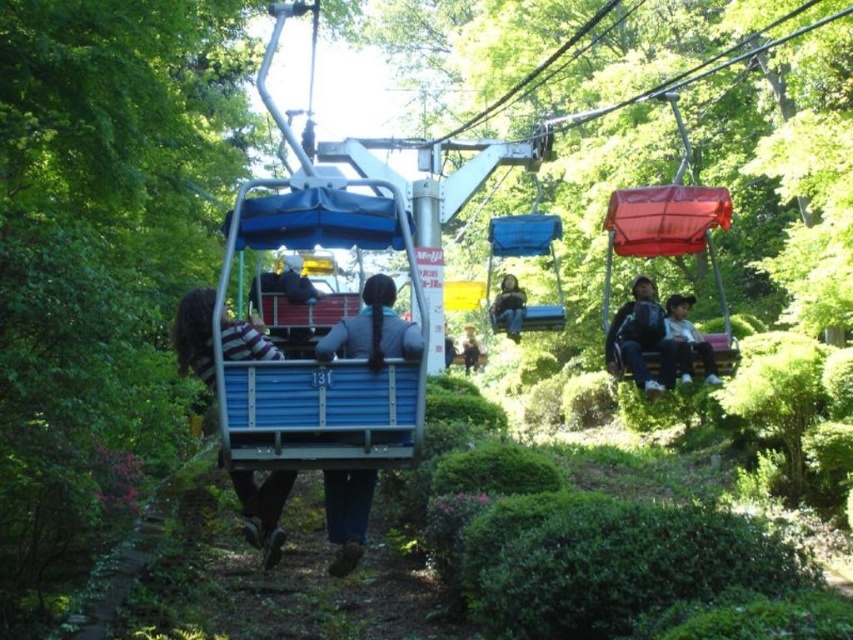
You are a photographer trying to capture a candid shot of two passengers in a cable car. You notice the matte black jacket at right and the matte blue jacket at center. Which passenger is more to the right side of the cable car?

The matte black jacket at right is positioned more to the right side of the cable car than the matte blue jacket at center.

You are a hiker who just boarded the cable car. You have a matte black backpack at right and a matte gray jacket at center. Which item is closer to the metal framework supporting the gondola?

The matte black backpack at right is shorter than the matte gray jacket at center, so it is closer to the metal framework supporting the gondola.

You are a passenger in the blue and red gondola of cable car 131 and notice a matte black jacket at right. Where exactly is the matte black jacket positioned in relation to the gondola?

The matte black jacket at right is located at point 0.530 on the x axis and 0.807 on the y axis relative to the gondola.